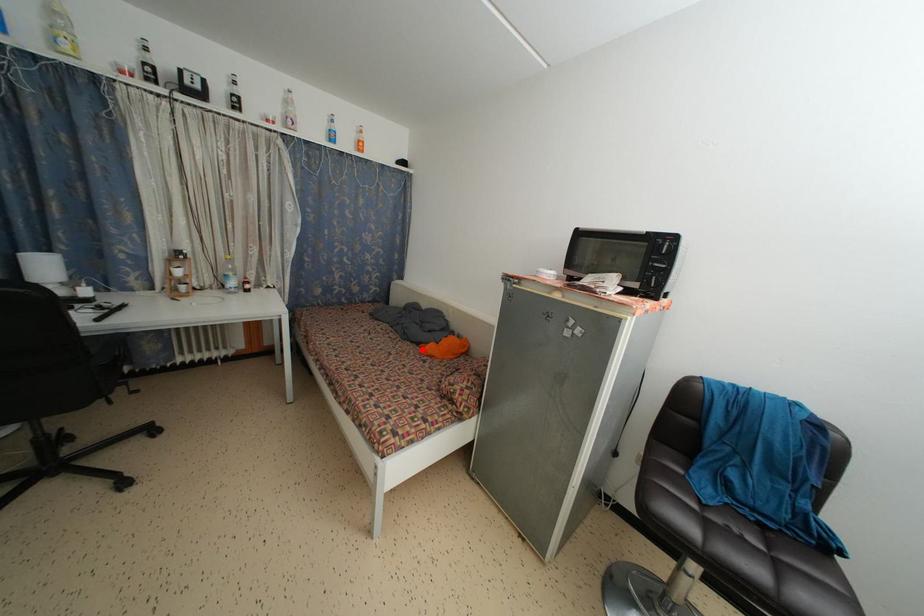
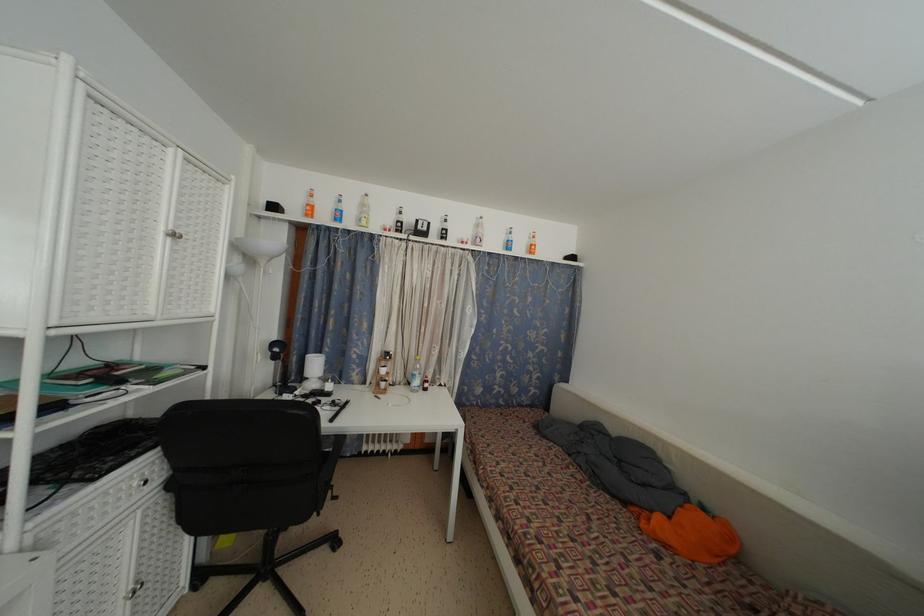
Where in the second image is the point corresponding to the highlighted location from the first image?

(629, 509)